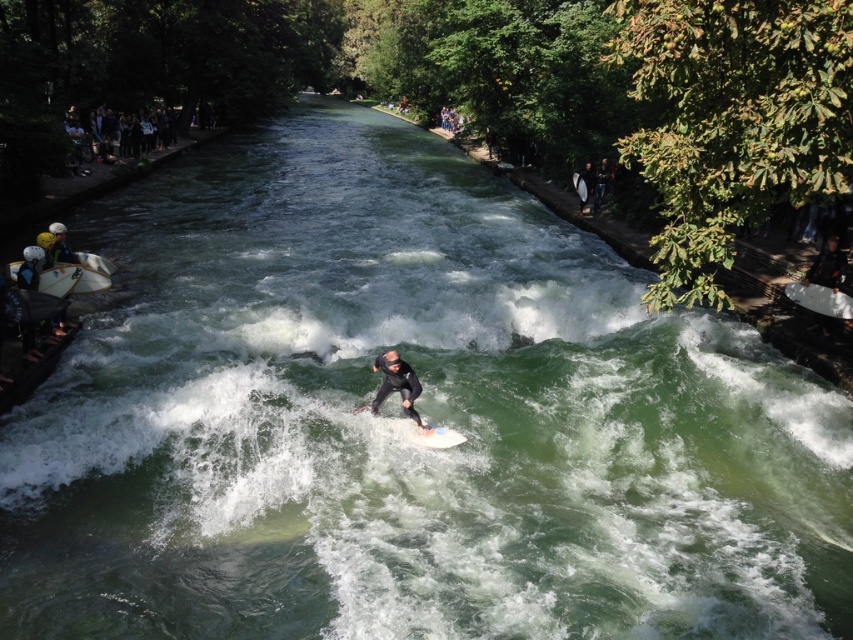
Can you confirm if white smooth surfboard at center is positioned below white matte surfboard at center?

Correct, white smooth surfboard at center is located below white matte surfboard at center.

Is white smooth surfboard at center to the left of white matte surfboard at center from the viewer's perspective?

In fact, white smooth surfboard at center is to the right of white matte surfboard at center.

Which is in front, point (784, 292) or point (584, 189)?

Point (784, 292) is in front.

Image resolution: width=853 pixels, height=640 pixels. Identify the location of white smooth surfboard at center. (819, 300).

This screenshot has height=640, width=853. What do you see at coordinates (422, 433) in the screenshot? I see `white foam surfboard at center` at bounding box center [422, 433].

Between white foam surfboard at center and dark blue wetsuit at upper right, which one appears on the left side from the viewer's perspective?

Positioned to the left is white foam surfboard at center.

Find the location of `white foam surfboard at center`. white foam surfboard at center is located at coordinates (422, 433).

Is white smooth surfboard at center to the right of white foam surfboard at center from the viewer's perspective?

Correct, you'll find white smooth surfboard at center to the right of white foam surfboard at center.

Who is taller, white smooth surfboard at center or white foam surfboard at center?

Standing taller between the two is white smooth surfboard at center.

Where is `white smooth surfboard at center`? The width and height of the screenshot is (853, 640). white smooth surfboard at center is located at coordinates (819, 300).

Where is `white smooth surfboard at center`? white smooth surfboard at center is located at coordinates (819, 300).